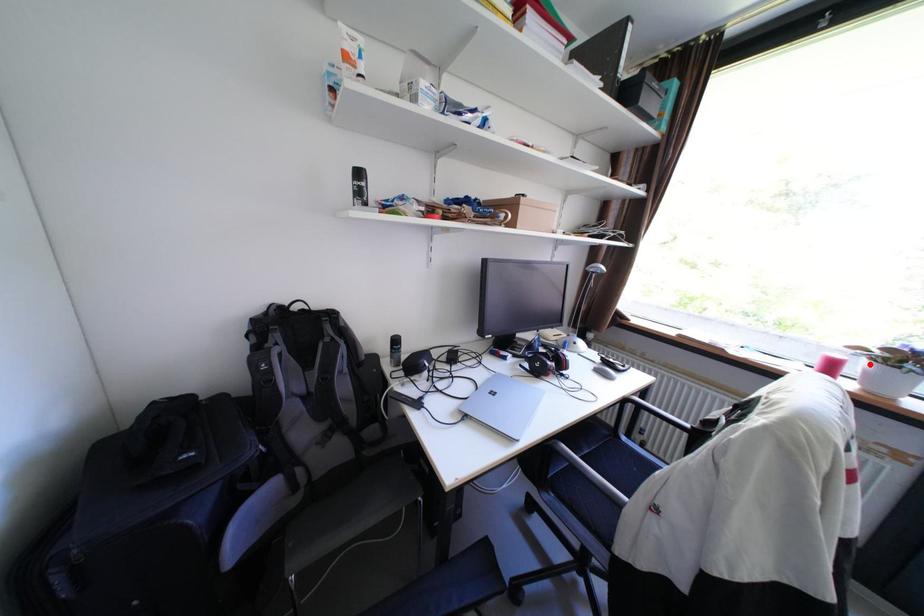
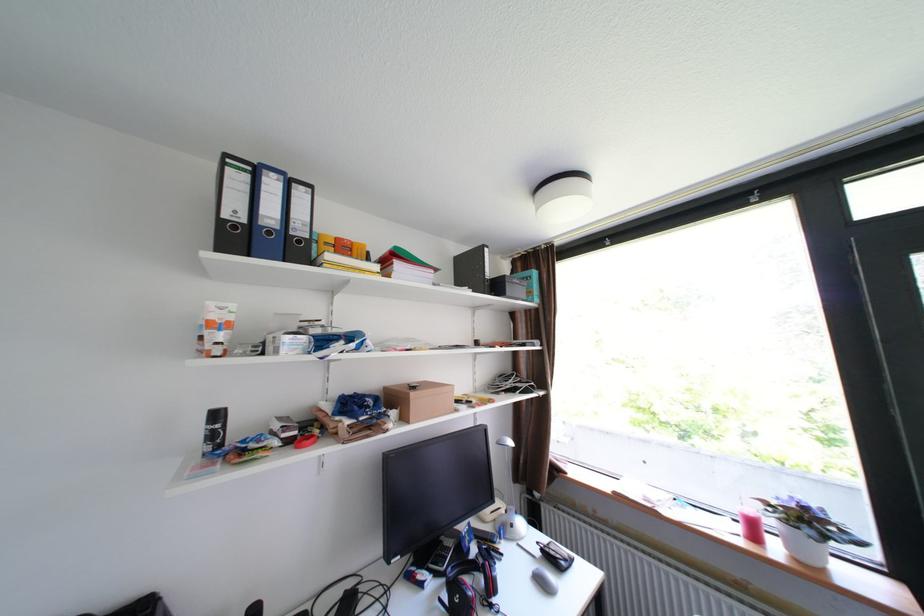
Question: I am providing you with two images of the same scene from different viewpoints. Image1 has a red point marked. In image2, the corresponding 3D location appears at what relative position? Reply with the corresponding letter.

Choices:
 (A) Closer
 (B) Farther

Answer: (A)